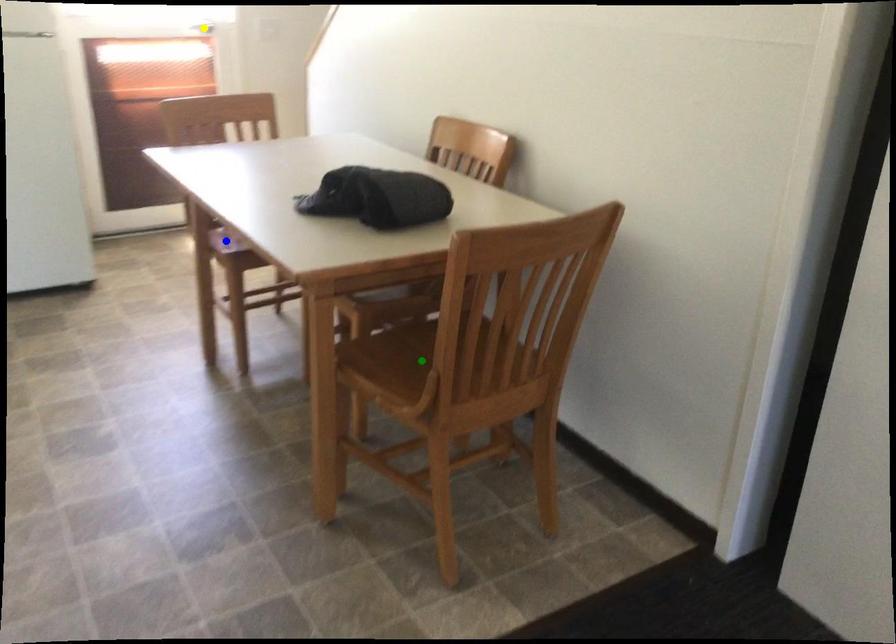
Order these from nearest to farthest:
- blue point
- green point
- yellow point

green point < blue point < yellow point